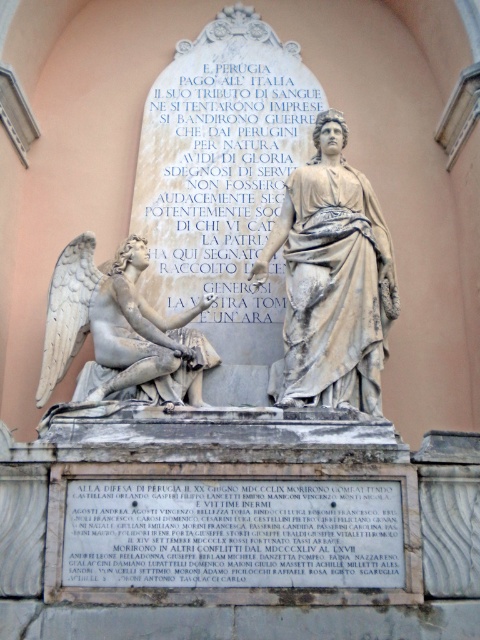
Question: Which of the following is the closest to the observer?

Choices:
 (A) (99, 358)
 (B) (235, 156)
 (C) (236, 112)

Answer: (A)

Question: Does white marble inscription at upper center appear on the right side of white marble angel at left?

Choices:
 (A) yes
 (B) no

Answer: (A)

Question: Estimate the real-world distances between objects in this image. Which object is farther from the white marble angel at left?

Choices:
 (A) white marble statue at center
 (B) black stone plaque at lower center

Answer: (B)

Question: Is white marble statue at center to the right of white marble angel at left from the viewer's perspective?

Choices:
 (A) no
 (B) yes

Answer: (B)

Question: Can you confirm if white marble statue at center is thinner than black stone plaque at lower center?

Choices:
 (A) yes
 (B) no

Answer: (B)

Question: Which object is positioned closest to the white marble statue at center?

Choices:
 (A) black stone plaque at lower center
 (B) white marble inscription at upper center
 (C) gray marble statue at center

Answer: (B)